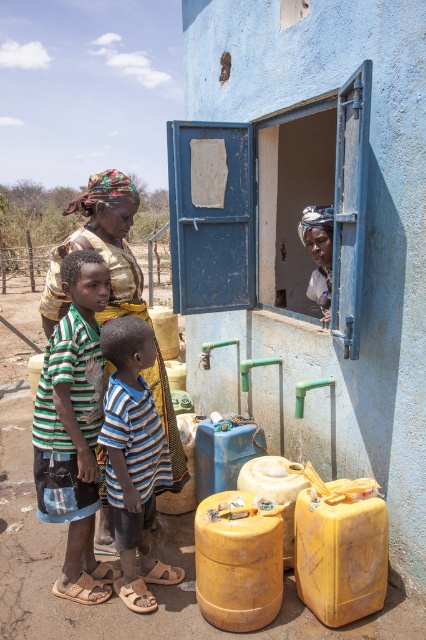
Does striped cotton shirt at center have a lesser width compared to striped fabric shirt at lower left?

No.

Can you confirm if striped cotton shirt at center is positioned below striped fabric shirt at lower left?

No.

Locate an element on the screen. striped cotton shirt at center is located at coordinates (x=72, y=426).

Which is more to the left, striped cotton shirt at center or matte yellow dress at center?

matte yellow dress at center

Measure the distance between striped cotton shirt at center and camera.

striped cotton shirt at center is 8.60 feet from camera.

In order to click on striped cotton shirt at center in this screenshot , I will do `click(72, 426)`.

Can you confirm if striped fabric shirt at lower left is taller than matte yellow dress at center?

Yes.

Who is more distant from viewer, (x=132, y=568) or (x=178, y=435)?

Positioned behind is point (x=178, y=435).

Locate an element on the screen. The image size is (426, 640). striped fabric shirt at lower left is located at coordinates (134, 458).